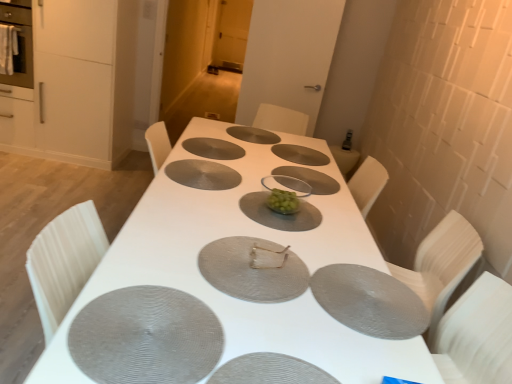
Identify the location of vacant space in between matte gray pizza pan at center, which appears as the sixth pizza pan when viewed from the front, and gray textured placemat at center, placed as the 7th pizza pan when sorted from back to front. (186, 210).